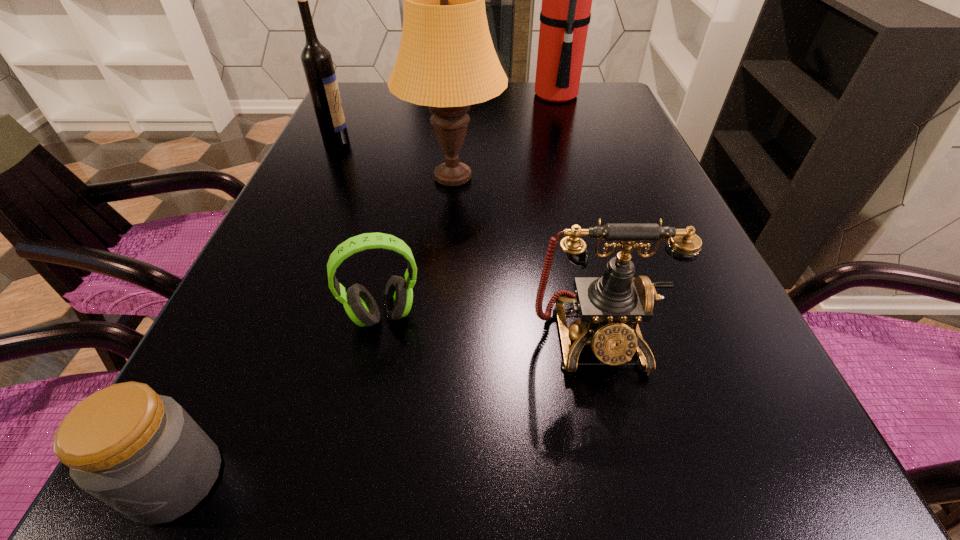
I want to click on free space that satisfies the following two spatial constraints: 1. at the nozzle of the tallest object; 2. on the surface of the jar near the warning symbol, so click(x=669, y=479).

Find the location of `vacant space that satisfies the following two spatial constraints: 1. on the label of the fifth nearest object; 2. on the right side of the fourth nearest object`. vacant space that satisfies the following two spatial constraints: 1. on the label of the fifth nearest object; 2. on the right side of the fourth nearest object is located at coordinates (319, 178).